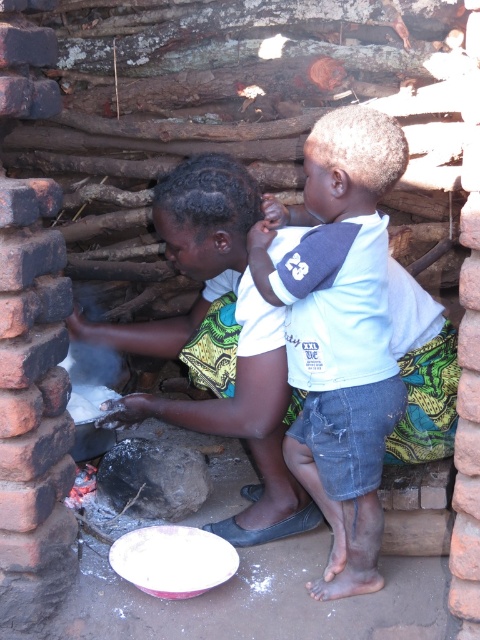
Question: Can you confirm if white cotton shirt at center is positioned to the right of white matte rock at lower center?

Choices:
 (A) no
 (B) yes

Answer: (B)

Question: Among these points, which one is nearest to the camera?

Choices:
 (A) (113, 392)
 (B) (399, 332)

Answer: (B)

Question: In this image, where is white cotton shirt at center located relative to white matte rock at lower center?

Choices:
 (A) below
 (B) above

Answer: (B)

Question: Which object appears closest to the camera in this image?

Choices:
 (A) green printed fabric at center
 (B) white matte rock at lower center
 (C) white cotton shirt at center

Answer: (C)

Question: Estimate the real-world distances between objects in this image. Which object is farther from the green printed fabric at center?

Choices:
 (A) white matte rock at lower center
 (B) white cotton shirt at center

Answer: (A)

Question: Can you confirm if green printed fabric at center is positioned below white cotton shirt at center?

Choices:
 (A) no
 (B) yes

Answer: (A)